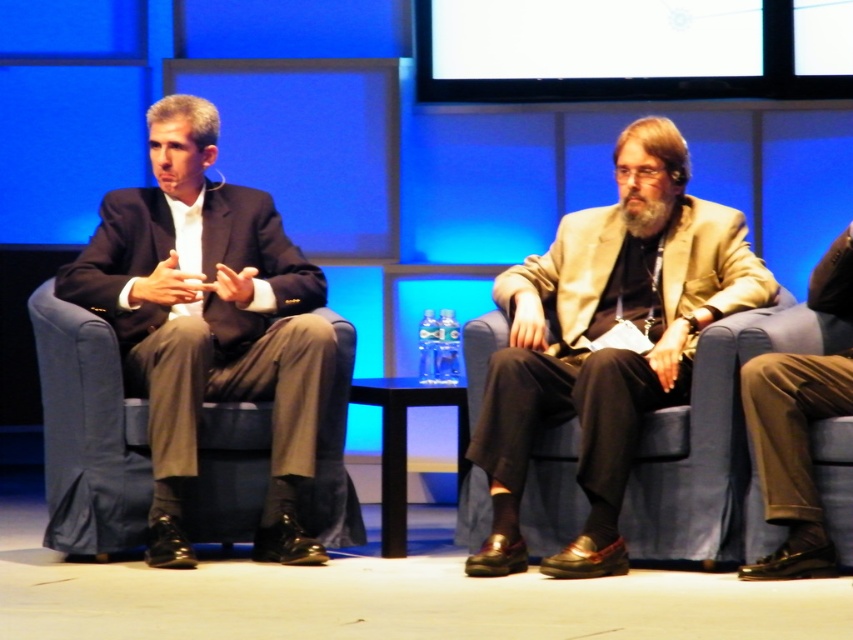
Question: Which is farther from the matte black suit at left?

Choices:
 (A) brown leather pants at lower right
 (B) beige woolen blazer at center

Answer: (A)

Question: Among these points, which one is farthest from the camera?

Choices:
 (A) (814, 388)
 (B) (641, 273)

Answer: (B)

Question: Is matte black suit at left positioned in front of brown leather pants at lower right?

Choices:
 (A) yes
 (B) no

Answer: (B)

Question: Which object is positioned farthest from the brown leather pants at lower right?

Choices:
 (A) matte black suit at left
 (B) beige woolen blazer at center

Answer: (A)

Question: Does beige woolen blazer at center come behind matte black suit at left?

Choices:
 (A) no
 (B) yes

Answer: (A)

Question: In this image, where is beige woolen blazer at center located relative to matte black suit at left?

Choices:
 (A) above
 (B) below

Answer: (B)